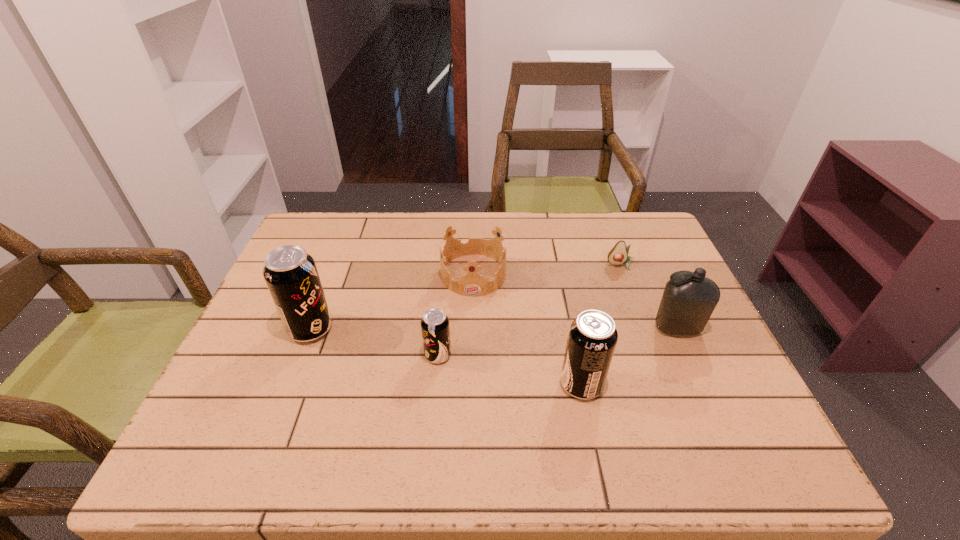
The soda cans are evenly distributed in the image. To maintain this, where would you place another soda can on the right? Please point to a free space. Please provide its 2D coordinates. Your answer should be formatted as a tuple, i.e. [(x, y)], where the tuple contains the x and y coordinates of a point satisfying the conditions above.

[(744, 418)]